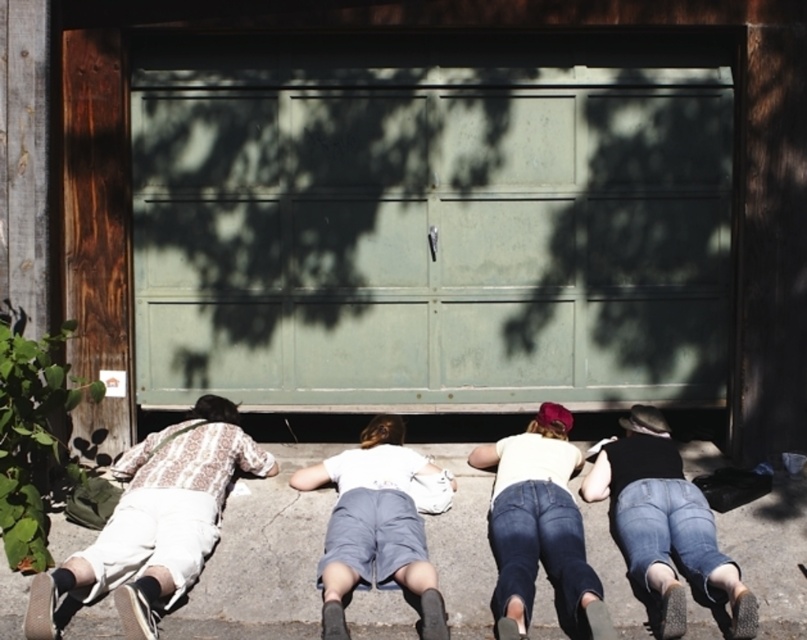
You are a delivery person trying to place a box on the surface in front of the garage door. The box requires a flat and level surface to avoid tipping over. Based on the image, which surface between the green painted metal at center and the gray concrete pavement at center would you choose to place the box?

The gray concrete pavement at center is the better choice because the green painted metal at center is taller than the gray concrete pavement at center, meaning the pavement is lower and likely flatter.

You are a photographer trying to capture a clear shot of the white cotton shirt at center and the denim jeans at center. Since the subjects are lying on the ground, you need to adjust your camera angle. Which object should you focus on first if you want to capture the one closer to the camera?

The denim jeans at center is above the white cotton shirt at center, so the denim jeans at center is closer to the camera. You should focus on the denim jeans at center first.

You are a photographer trying to capture a group photo of the denim jeans at center and the white cotton shirt at center. Since you want to focus on the details of the clothing, which clothing item should you zoom in on to ensure it appears thinner in the photo?

The denim jeans at center is thinner than the white cotton shirt at center, so you should zoom in on the denim jeans at center to ensure it appears thinner in the photo.